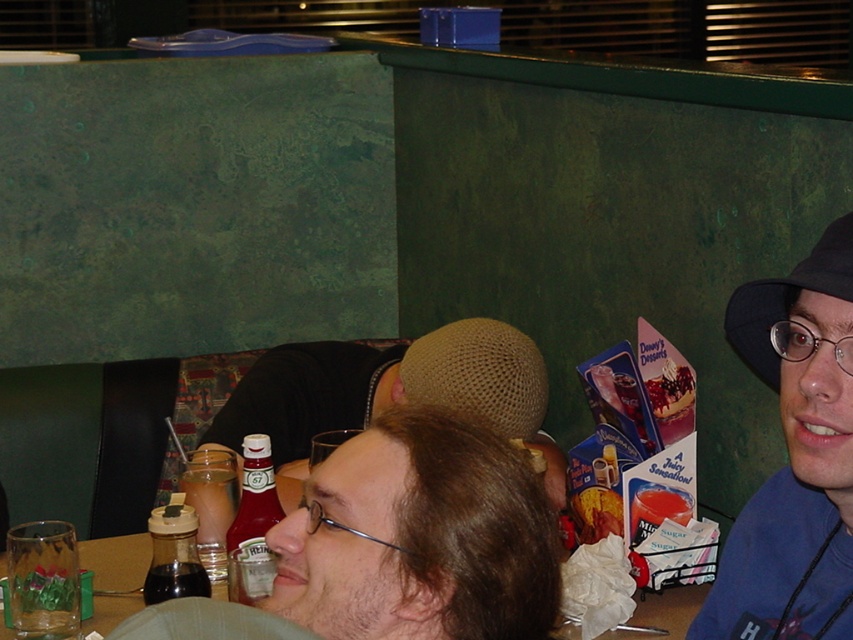
Looking at this image, you are a diner employee who needs to place a new menu on the table. The menu is 12 inches wide. The blue fabric hat at right is currently on the table. Can the menu fit on the translucent glass table at center without overlapping the hat?

The blue fabric hat at right has a lesser width compared to the translucent glass table at center. Since the menu is 12 inches wide and the table is wider than the hat, the menu can fit on the translucent glass table at center without overlapping the hat.

What object is located at the coordinates point (398, 545) in the image?

The point (398, 545) indicates a matte plastic bottle at center.

Based on the photo, you are a waiter in a diner and you see a matte plastic bottle at center and a brown mesh hat at center on the table. Which item is closer to the floor?

The matte plastic bottle at center is closer to the floor because it is positioned below the brown mesh hat at center.